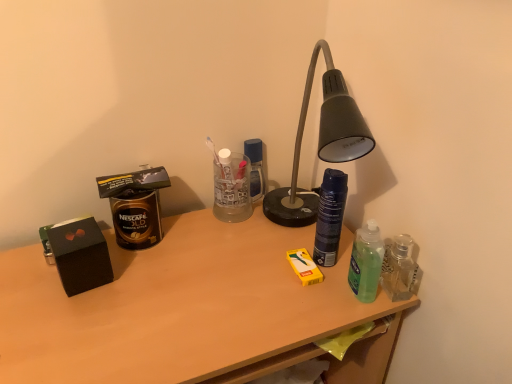
The height and width of the screenshot is (384, 512). I want to click on vacant space in front of gold matte canister at left, so click(x=128, y=294).